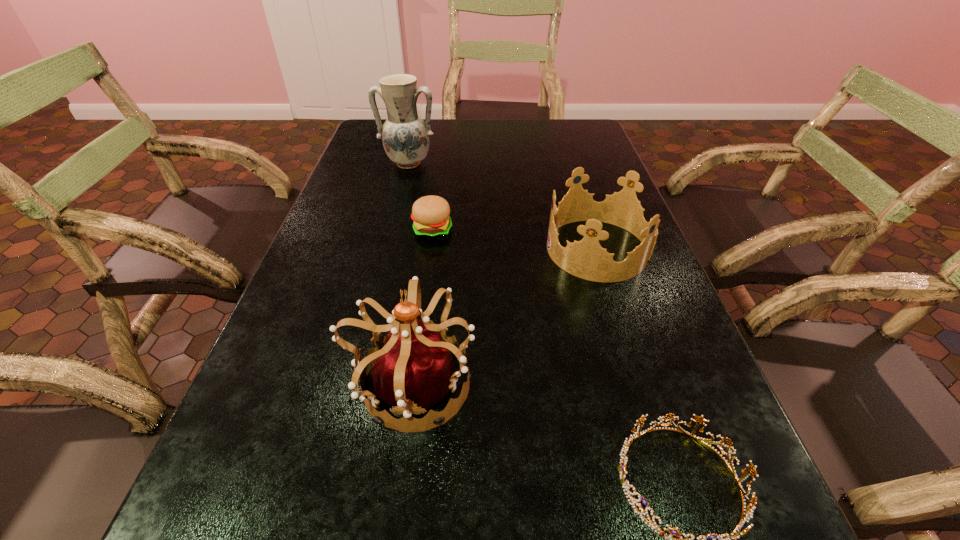
The width and height of the screenshot is (960, 540). I want to click on free space located 0.080m on the back of the fourth tallest object, so (x=437, y=203).

Where is `object at the left edge`? The width and height of the screenshot is (960, 540). object at the left edge is located at coordinates (405, 136).

Locate an element on the screen. object positioned at the right edge is located at coordinates (586, 259).

The height and width of the screenshot is (540, 960). What are the coordinates of `vacant space at the far edge of the desktop` in the screenshot? It's located at (444, 139).

Find the location of a particular element. free space at the left edge is located at coordinates (265, 528).

Where is `vacant space at the right edge of the desktop`? This screenshot has width=960, height=540. vacant space at the right edge of the desktop is located at coordinates (659, 281).

Where is `vacant area at the far right corner`? The width and height of the screenshot is (960, 540). vacant area at the far right corner is located at coordinates (571, 118).

Identify the location of free spot between the fourth tallest object and the tallest tiara. The image size is (960, 540). (421, 308).

This screenshot has height=540, width=960. In order to click on vacant space that's between the pottery and the leftmost tiara in this screenshot , I will do `click(410, 274)`.

You are a GUI agent. You are given a task and a screenshot of the screen. Output one action in this format:
    pyautogui.click(x=<x>, y=<y>)
    Task: Click on the empty space between the pottery and the second shortest object
    Image resolution: width=960 pixels, height=540 pixels.
    Given the screenshot: What is the action you would take?
    pyautogui.click(x=420, y=197)